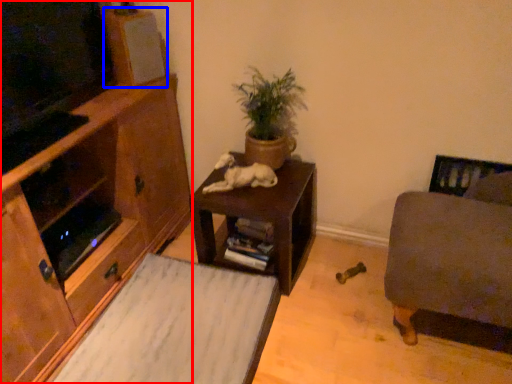
Question: Which object appears closest to the camera in this image, cabinetry (highlighted by a red box) or speaker (highlighted by a blue box)?

Choices:
 (A) cabinetry
 (B) speaker

Answer: (A)